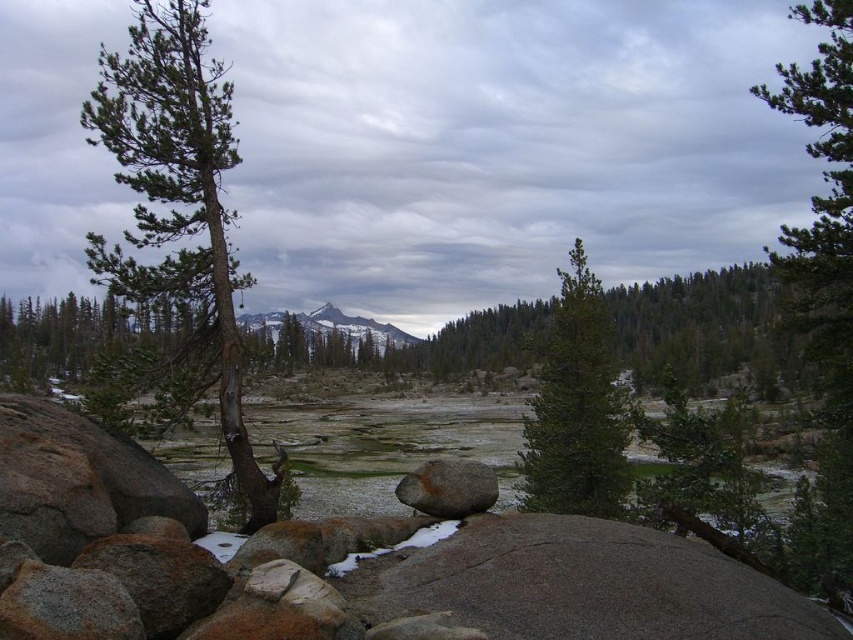
Question: Which object is the closest to the green matte tree at center?

Choices:
 (A) green textured pine tree at left
 (B) snowy granite mountain at center
 (C) rusty metallic boulder at center

Answer: (C)

Question: Does green matte tree at center have a greater width compared to rusty metallic boulder at center?

Choices:
 (A) no
 (B) yes

Answer: (B)

Question: Which of the following is the closest to the observer?

Choices:
 (A) (599, 440)
 (B) (107, 97)

Answer: (B)

Question: Estimate the real-world distances between objects in this image. Which object is closer to the rusty metallic boulder at center?

Choices:
 (A) snowy granite mountain at center
 (B) green matte tree at center

Answer: (B)

Question: Is green textured pine tree at left above green matte tree at center?

Choices:
 (A) no
 (B) yes

Answer: (B)

Question: Where is rusty metallic boulder at center located in relation to snowy granite mountain at center in the image?

Choices:
 (A) right
 (B) left

Answer: (A)